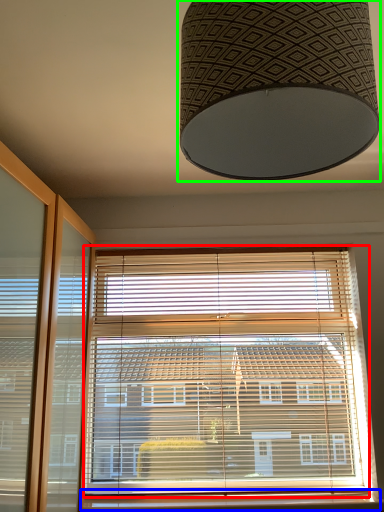
Question: Estimate the real-world distances between objects in this image. Which object is closer to window blind (highlighted by a red box), window sill (highlighted by a blue box) or lamp (highlighted by a green box)?

Choices:
 (A) window sill
 (B) lamp

Answer: (A)